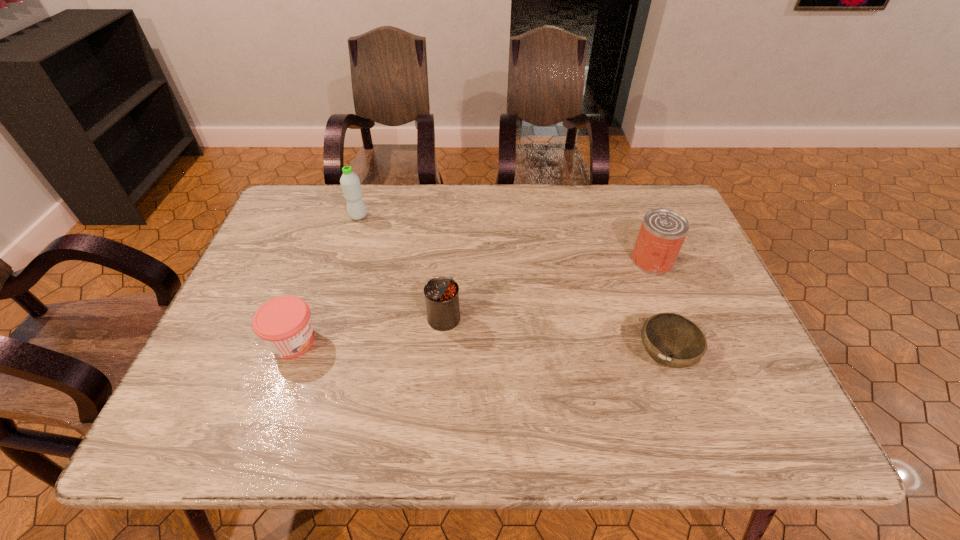
Identify the location of vacant space at the far left corner of the desktop. (297, 200).

I want to click on vacant space that's between the third object from left to right and the farthest object, so click(x=401, y=267).

The height and width of the screenshot is (540, 960). I want to click on free space between the bowl and the jam, so click(x=479, y=349).

Locate an element on the screen. This screenshot has height=540, width=960. free space between the right can and the farthest object is located at coordinates (505, 239).

I want to click on unoccupied position between the farther can and the shortest object, so click(658, 309).

The width and height of the screenshot is (960, 540). I want to click on free spot between the farthest object and the fourth nearest object, so click(x=505, y=239).

Where is `vacant area that lies between the second shortest object and the third object from left to right`? This screenshot has width=960, height=540. vacant area that lies between the second shortest object and the third object from left to right is located at coordinates (369, 330).

Identify the location of free spot between the jam and the shortest object. This screenshot has width=960, height=540. (479, 349).

Where is `vacant region between the farthest object and the nearer can`? This screenshot has width=960, height=540. vacant region between the farthest object and the nearer can is located at coordinates (401, 267).

Where is `empty space that is in between the second shortest object and the tallest object`? The width and height of the screenshot is (960, 540). empty space that is in between the second shortest object and the tallest object is located at coordinates tap(325, 279).